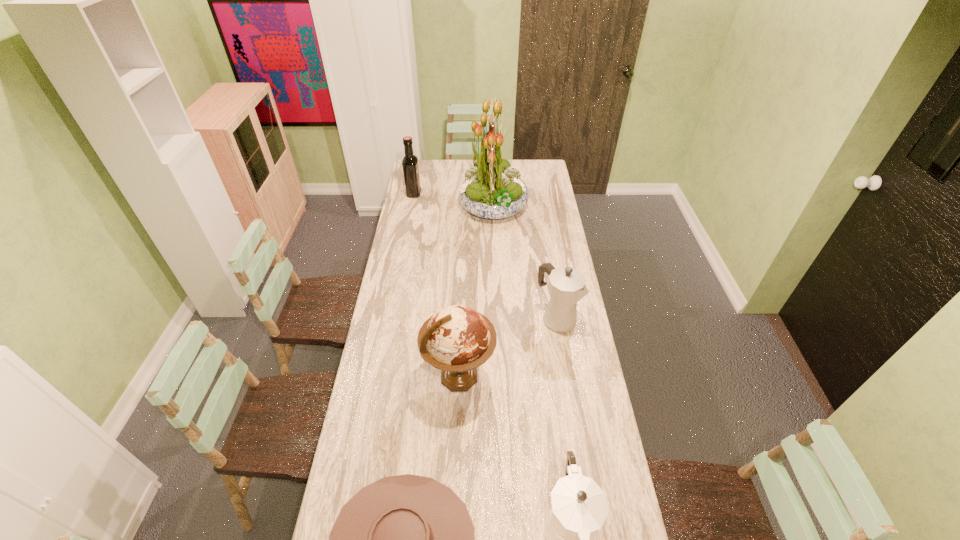
At what (x,y) coordinates should I click in order to perform the action: click on object that is at the left edge. Please return your answer as a coordinate pair (x, y). The height and width of the screenshot is (540, 960). Looking at the image, I should click on (410, 161).

The height and width of the screenshot is (540, 960). I want to click on flower arrangement that is at the right edge, so click(x=493, y=189).

At what (x,y) coordinates should I click in order to perform the action: click on coffeepot present at the right edge. Please return your answer as a coordinate pair (x, y). Image resolution: width=960 pixels, height=540 pixels. Looking at the image, I should click on (567, 286).

In the image, there is a desktop. At what (x,y) coordinates should I click in order to perform the action: click on vacant region at the far edge. Please return your answer as a coordinate pair (x, y). The image size is (960, 540). Looking at the image, I should click on (511, 165).

In the image, there is a desktop. Where is `vacant space at the left edge`? This screenshot has height=540, width=960. vacant space at the left edge is located at coordinates (416, 330).

This screenshot has width=960, height=540. Find the location of `blank space at the right edge of the desktop`. blank space at the right edge of the desktop is located at coordinates (584, 355).

The width and height of the screenshot is (960, 540). Find the location of `free space at the far left corner`. free space at the far left corner is located at coordinates (433, 161).

Find the location of `empty space between the liquor and the tallest object`. empty space between the liquor and the tallest object is located at coordinates (454, 200).

What are the coordinates of `free space between the flower arrangement and the globe` in the screenshot? It's located at (476, 292).

Find the location of a particular element. free area in between the fourth nearest object and the tallest object is located at coordinates (525, 262).